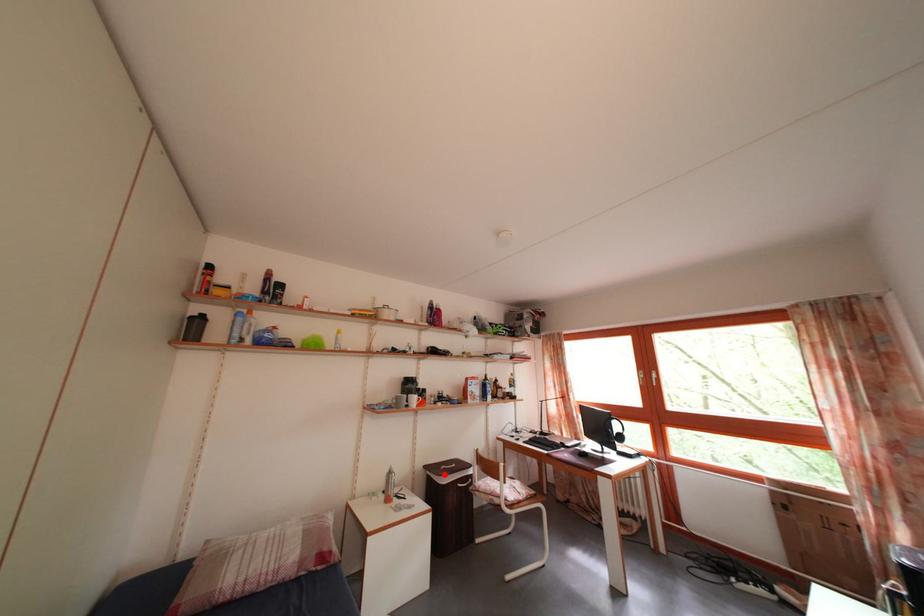
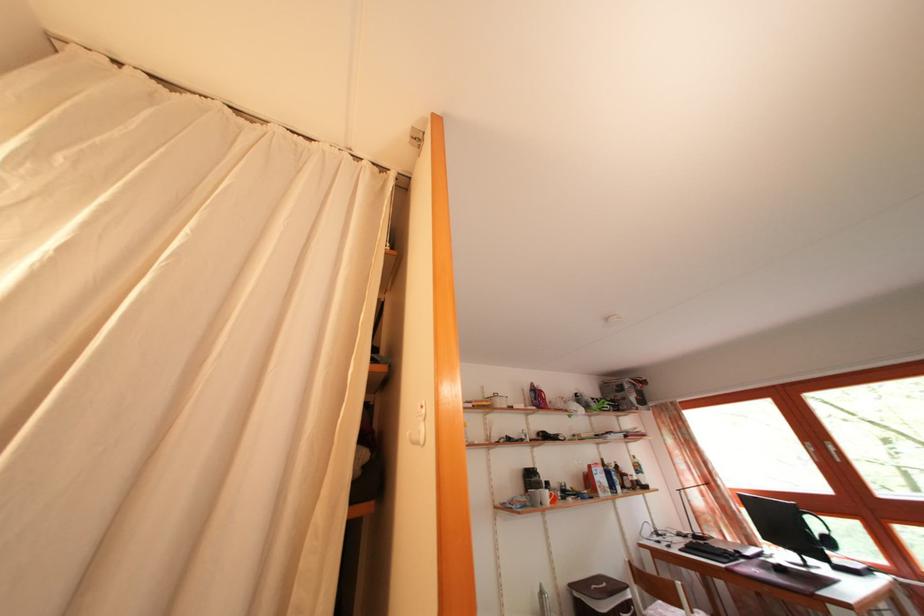
Locate, in the second image, the point that corresponds to the highlighted location in the first image.

(592, 594)